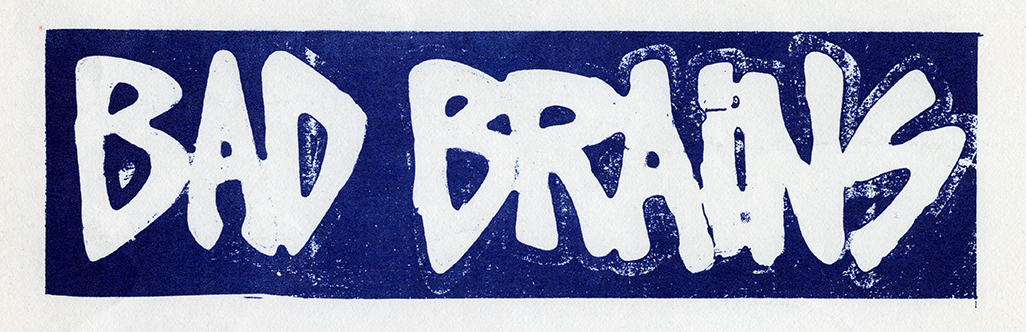
Locate an element on the screen. This screenshot has width=1026, height=332. frame is located at coordinates (131, 19).